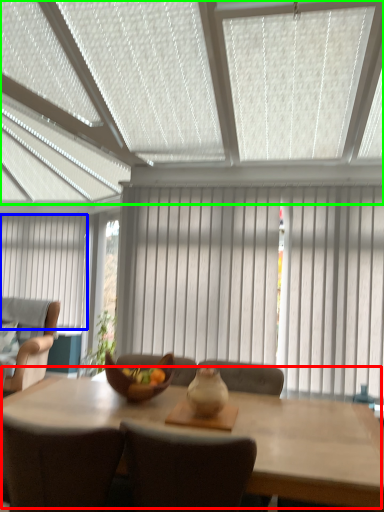
Question: Which object is the closest to the kitchen & dining room table (highlighted by a red box)? Choose among these: curtain (highlighted by a blue box) or window blind (highlighted by a green box).

Choices:
 (A) curtain
 (B) window blind

Answer: (B)